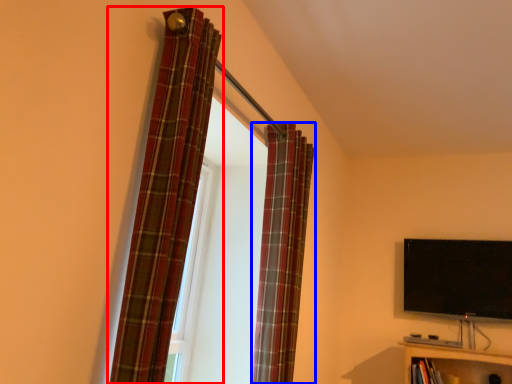
Question: Which object is closer to the camera taking this photo, curtain (highlighted by a red box) or curtain (highlighted by a blue box)?

Choices:
 (A) curtain
 (B) curtain

Answer: (A)